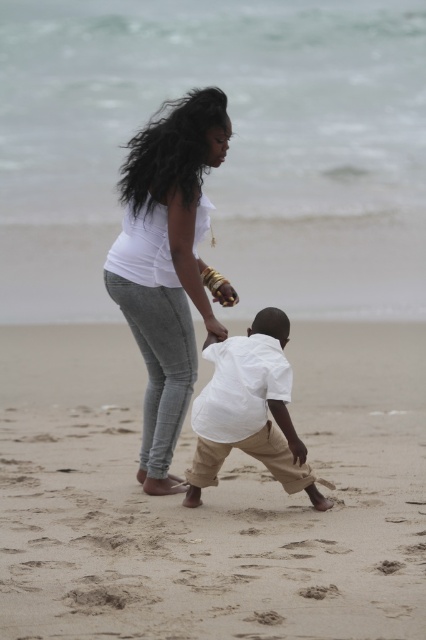
Is sandy beige sand at center to the left of white cotton shirt at center from the viewer's perspective?

Correct, you'll find sandy beige sand at center to the left of white cotton shirt at center.

Does point (386, 573) come in front of point (271, 413)?

Yes, point (386, 573) is in front of point (271, 413).

Identify the location of sandy beige sand at center. The width and height of the screenshot is (426, 640). (210, 499).

Does sandy beige sand at center have a greater height compared to white matte shirt at center?

In fact, sandy beige sand at center may be shorter than white matte shirt at center.

Which is behind, point (68, 534) or point (124, 193)?

The point (124, 193) is behind.

The width and height of the screenshot is (426, 640). Describe the element at coordinates (210, 499) in the screenshot. I see `sandy beige sand at center` at that location.

Identify the location of sandy beige sand at center. (210, 499).

The image size is (426, 640). What do you see at coordinates (167, 264) in the screenshot? I see `white matte shirt at center` at bounding box center [167, 264].

You are a GUI agent. You are given a task and a screenshot of the screen. Output one action in this format:
    pyautogui.click(x=<x>, y=<y>)
    Task: Click on the white matte shirt at center
    
    Given the screenshot: What is the action you would take?
    pyautogui.click(x=167, y=264)